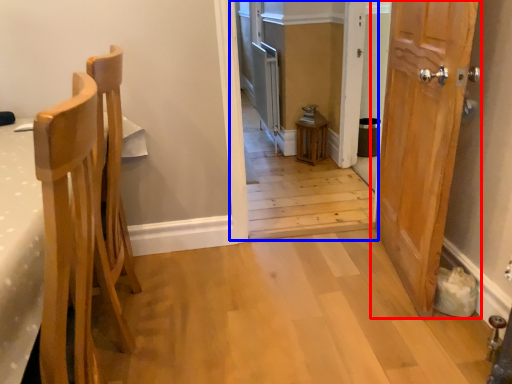
Question: Which point is closer to the camera, door (highlighted by a red box) or corridor (highlighted by a blue box)?

Choices:
 (A) door
 (B) corridor

Answer: (A)